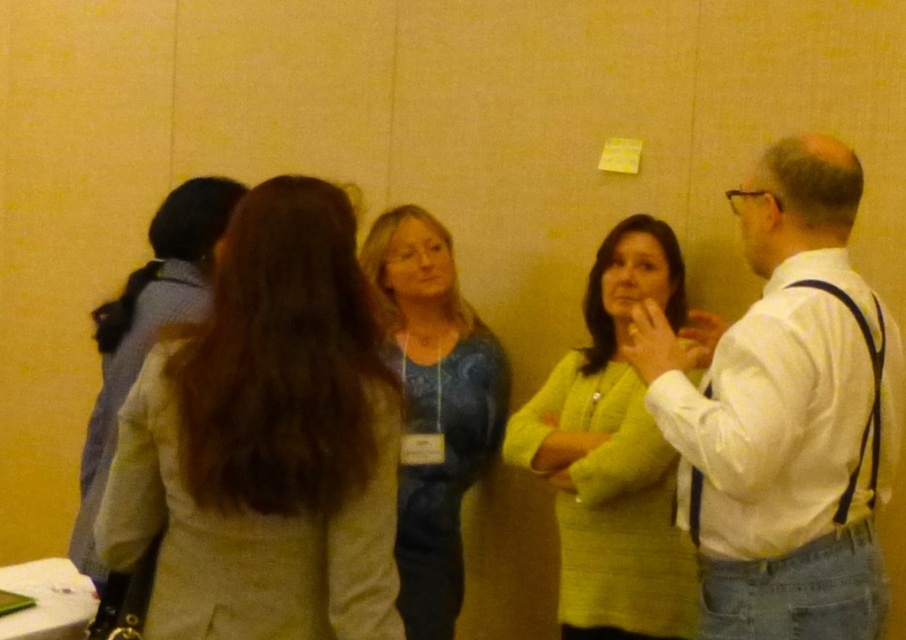
Between light beige fabric coat at center and white shirt at center, which one is positioned higher?

white shirt at center is above.

Who is lower down, light beige fabric coat at center or white shirt at center?

light beige fabric coat at center is lower down.

The image size is (906, 640). What are the coordinates of `light beige fabric coat at center` in the screenshot? It's located at (265, 440).

This screenshot has width=906, height=640. In order to click on light beige fabric coat at center in this screenshot , I will do `click(265, 440)`.

Which is behind, point (760, 323) or point (610, 436)?

The point (610, 436) is behind.

Between white shirt at center and matte green sweater at center, which one has less height?

Standing shorter between the two is white shirt at center.

Who is more forward, [787,234] or [603,529]?

Positioned in front is point [787,234].

You are a GUI agent. You are given a task and a screenshot of the screen. Output one action in this format:
    pyautogui.click(x=<x>, y=<y>)
    Task: Click on the white shirt at center
    
    Given the screenshot: What is the action you would take?
    pyautogui.click(x=784, y=413)

Which is below, light beige fabric coat at center or matte green sweater at center?

matte green sweater at center is lower down.

Measure the distance between point (x=190, y=449) and camera.

Point (x=190, y=449) is 1.48 meters away from camera.

What are the coordinates of `light beige fabric coat at center` in the screenshot? It's located at (265, 440).